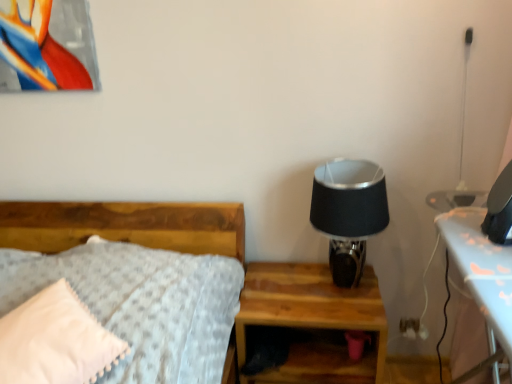
Question: From the image's perspective, is white soft pillow at left over white plastic electric outlet at lower right?

Choices:
 (A) yes
 (B) no

Answer: (A)

Question: Considering the relative positions of white soft pillow at left and white plastic electric outlet at lower right in the image provided, is white soft pillow at left to the right of white plastic electric outlet at lower right from the viewer's perspective?

Choices:
 (A) no
 (B) yes

Answer: (A)

Question: Is white soft pillow at left completely or partially outside of white plastic electric outlet at lower right?

Choices:
 (A) no
 (B) yes

Answer: (B)

Question: Is white soft pillow at left closer to camera compared to white plastic electric outlet at lower right?

Choices:
 (A) no
 (B) yes

Answer: (B)

Question: Is white soft pillow at left oriented towards white plastic electric outlet at lower right?

Choices:
 (A) no
 (B) yes

Answer: (A)

Question: Is metallic silver picture frame at upper left taller or shorter than white plastic electric outlet at lower right?

Choices:
 (A) tall
 (B) short

Answer: (A)

Question: From the image's perspective, relative to white plastic electric outlet at lower right, is metallic silver picture frame at upper left above or below?

Choices:
 (A) below
 (B) above

Answer: (B)

Question: Is point (25, 14) positioned closer to the camera than point (402, 319)?

Choices:
 (A) closer
 (B) farther

Answer: (A)

Question: Is metallic silver picture frame at upper left wider or thinner than white plastic electric outlet at lower right?

Choices:
 (A) wide
 (B) thin

Answer: (A)

Question: From the image's perspective, is wooden nightstand at lower right located above or below white plastic electric outlet at lower right?

Choices:
 (A) above
 (B) below

Answer: (B)

Question: Based on their positions, is wooden nightstand at lower right located to the left or right of white plastic electric outlet at lower right?

Choices:
 (A) right
 (B) left

Answer: (B)

Question: Is point (381, 311) closer or farther from the camera than point (416, 319)?

Choices:
 (A) closer
 (B) farther

Answer: (A)

Question: Looking at their shapes, would you say wooden nightstand at lower right is wider or thinner than white plastic electric outlet at lower right?

Choices:
 (A) thin
 (B) wide

Answer: (B)

Question: Is point (340, 281) positioned closer to the camera than point (84, 46)?

Choices:
 (A) closer
 (B) farther

Answer: (B)

Question: In terms of width, does black fabric lampshade at upper right look wider or thinner when compared to metallic silver picture frame at upper left?

Choices:
 (A) wide
 (B) thin

Answer: (A)